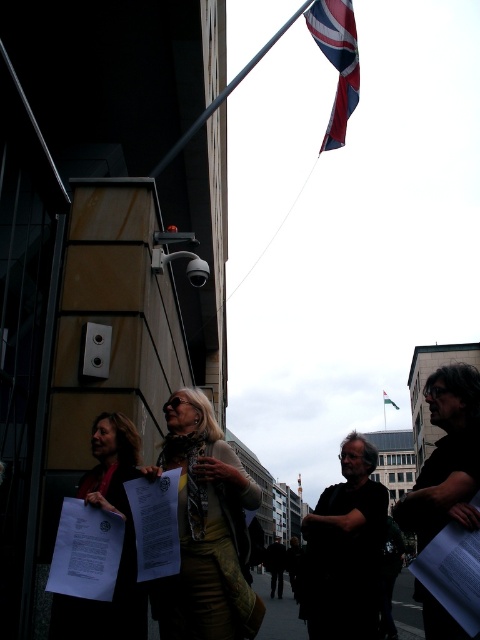
Question: Does metallic pole at upper center have a larger size compared to union jack fabric flag at upper center?

Choices:
 (A) no
 (B) yes

Answer: (B)

Question: Is white paper at center bigger than union jack fabric flag at upper center?

Choices:
 (A) yes
 (B) no

Answer: (B)

Question: Which object is farther from the camera taking this photo?

Choices:
 (A) red and blue fabric flag at upper right
 (B) white paper at center
 (C) metallic pole at upper center
 (D) gold metallic dress at center

Answer: (C)

Question: Which point is closer to the camera?

Choices:
 (A) (344, 80)
 (B) (144, 602)
 (C) (385, 397)
 (D) (211, 548)

Answer: (B)

Question: Which point is closer to the camera?

Choices:
 (A) (205, 113)
 (B) (351, 65)

Answer: (B)

Question: Can you confirm if red and blue fabric flag at upper right is thinner than metallic pole at upper center?

Choices:
 (A) no
 (B) yes

Answer: (B)